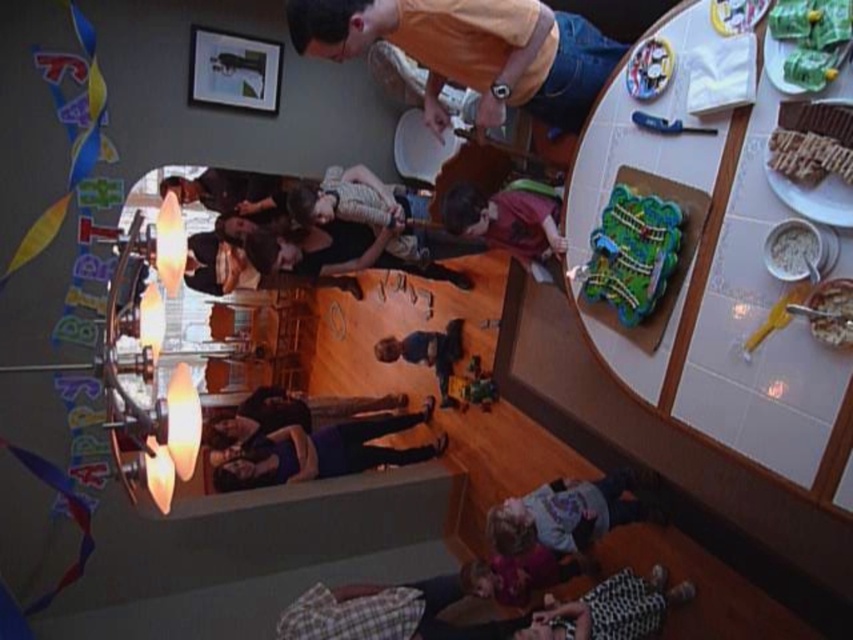
Question: Estimate the real-world distances between objects in this image. Which object is farther from the orange cotton shirt at upper center?

Choices:
 (A) green plastic toy at center
 (B) white creamy bowl at right

Answer: (A)

Question: Does light purple fleece at lower center have a larger size compared to smooth brown leather jacket at center?

Choices:
 (A) yes
 (B) no

Answer: (B)

Question: Does white creamy bowl at right have a smaller size compared to green plastic toy at center?

Choices:
 (A) yes
 (B) no

Answer: (A)

Question: Which object appears closest to the camera in this image?

Choices:
 (A) green plastic train set at center
 (B) blue fabric shirt at center

Answer: (A)

Question: Is the position of orange cotton shirt at upper center more distant than that of light purple fleece at lower center?

Choices:
 (A) no
 (B) yes

Answer: (A)

Question: Which of the following is the closest to the observer?

Choices:
 (A) chocolate cake at upper right
 (B) green plastic toy at center
 (C) light purple fleece at lower center
 (D) white creamy bowl at right

Answer: (A)